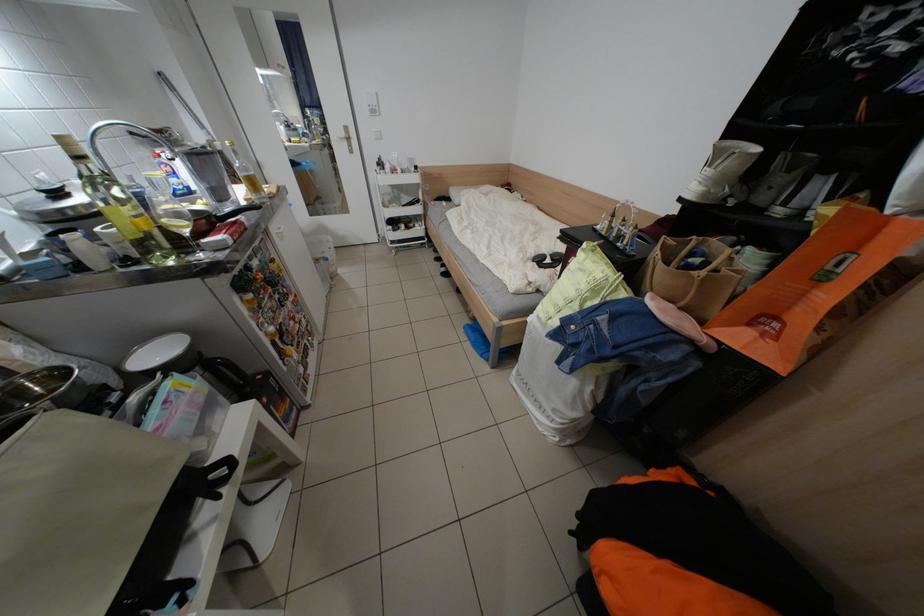
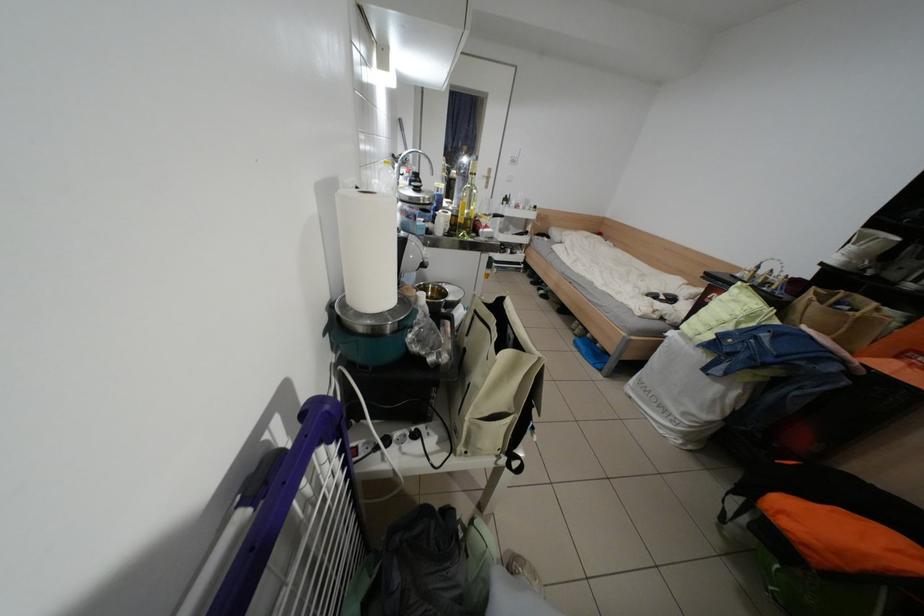
The images are taken continuously from a first-person perspective. In which direction are you moving?

The movement direction of the cameraman is left, backward.